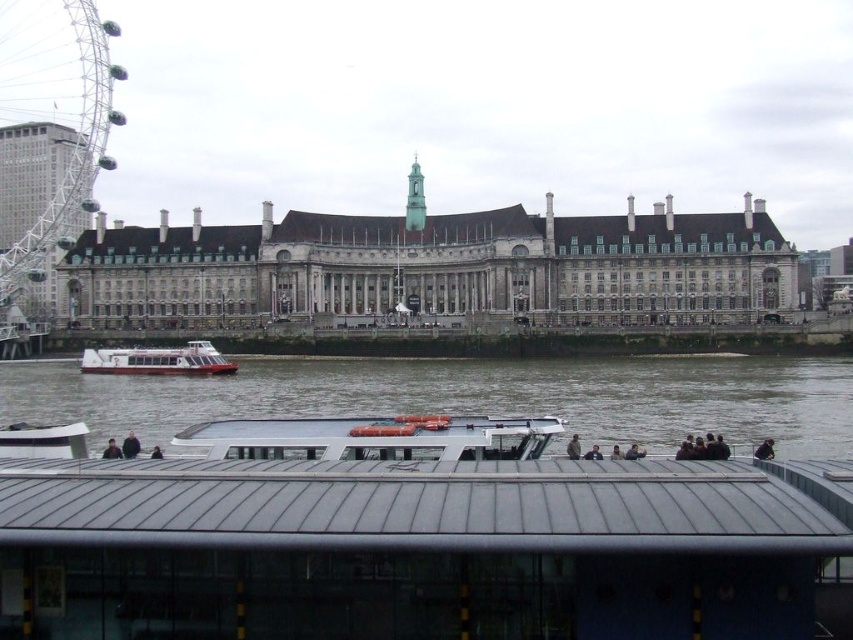
Question: Observing the image, what is the correct spatial positioning of gray stone building at center in reference to white glossy boat at center?

Choices:
 (A) above
 (B) below

Answer: (A)

Question: Does brown water at lower center come behind metallic ferris wheel at left?

Choices:
 (A) no
 (B) yes

Answer: (A)

Question: Which of these objects is positioned farthest from the white glossy boat at center?

Choices:
 (A) gray stone building at center
 (B) brown water at lower center

Answer: (A)

Question: Estimate the real-world distances between objects in this image. Which object is closer to the brown water at lower center?

Choices:
 (A) gray stone building at center
 (B) metallic ferris wheel at left

Answer: (A)

Question: In this image, where is gray stone building at center located relative to brown water at lower center?

Choices:
 (A) right
 (B) left

Answer: (B)

Question: Which is nearer to the white glossy boat at center?

Choices:
 (A) metallic ferris wheel at left
 (B) brown water at lower center
 (C) gray stone building at center

Answer: (B)